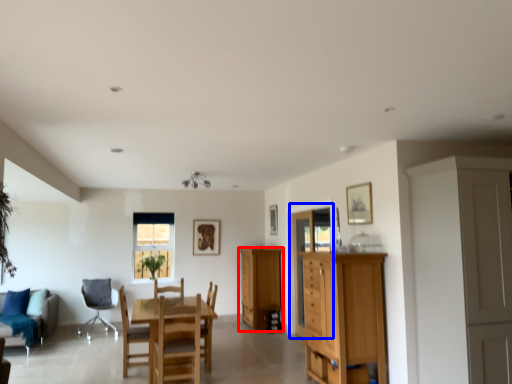
Question: Among these objects, which one is nearest to the camera, cabinetry (highlighted by a red box) or glass door (highlighted by a blue box)?

Choices:
 (A) cabinetry
 (B) glass door

Answer: (B)